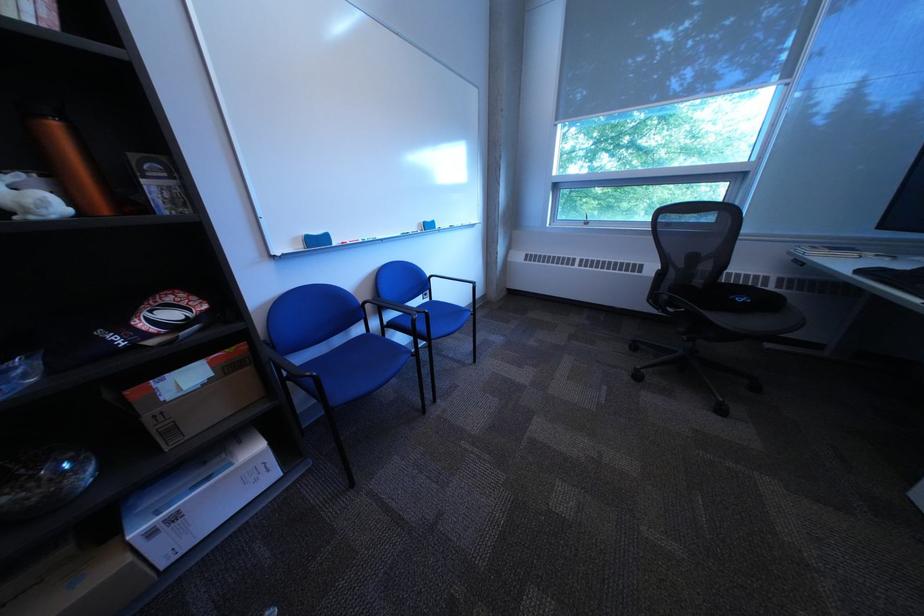
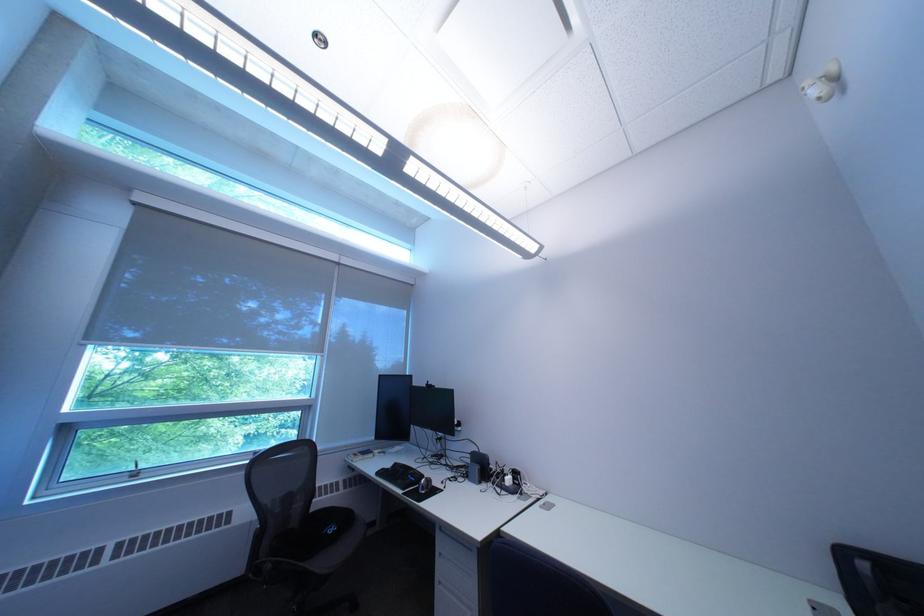
Find the pixel in the second image that matches the point at 877,274 in the first image.

(393, 475)